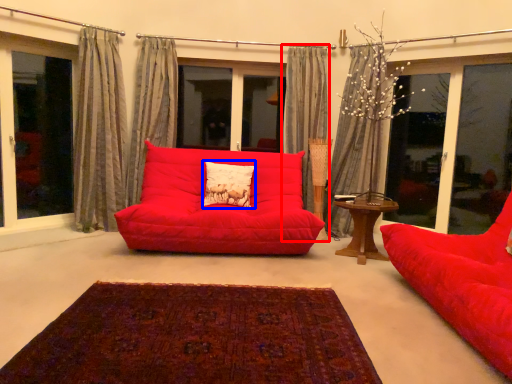
Question: Which object appears farthest to the camera in this image, curtain (highlighted by a red box) or pillow (highlighted by a blue box)?

Choices:
 (A) curtain
 (B) pillow

Answer: (A)